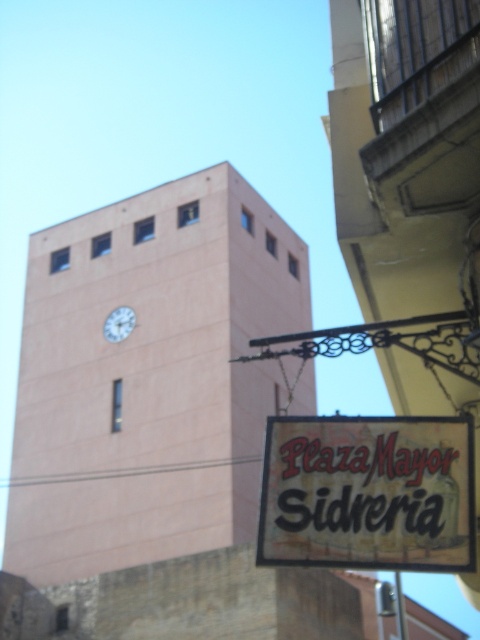
From the picture: Can you confirm if matte pink clock tower at center is positioned to the right of matte black sign at lower right?

No, matte pink clock tower at center is not to the right of matte black sign at lower right.

Between point (295, 289) and point (381, 426), which one is positioned behind?

The point (295, 289) is behind.

You are a GUI agent. You are given a task and a screenshot of the screen. Output one action in this format:
    pyautogui.click(x=<x>, y=<y>)
    Task: Click on the matte pink clock tower at center
    The height and width of the screenshot is (640, 480).
    Given the screenshot: What is the action you would take?
    pyautogui.click(x=157, y=426)

Between point (262, 216) and point (111, 321), which one is positioned in front?

Point (111, 321) is more forward.

Is the position of matte pink clock tower at center less distant than that of white glossy clock at upper center?

Yes, matte pink clock tower at center is in front of white glossy clock at upper center.

Which is behind, point (101, 577) or point (117, 321)?

The point (117, 321) is behind.

The width and height of the screenshot is (480, 640). I want to click on matte pink clock tower at center, so click(157, 426).

Who is higher up, matte black sign at lower right or white glossy clock at upper center?

white glossy clock at upper center

Who is lower down, matte black sign at lower right or white glossy clock at upper center?

Positioned lower is matte black sign at lower right.

Find the location of a particular element. This screenshot has height=640, width=480. matte black sign at lower right is located at coordinates (368, 493).